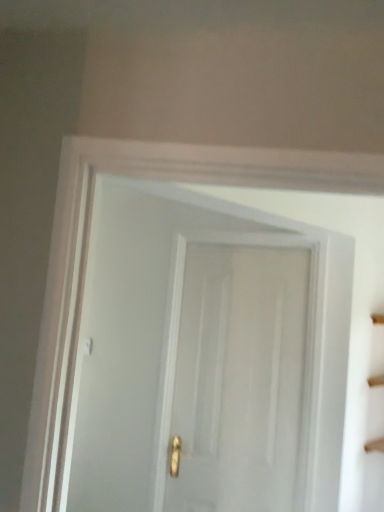
Question: Should I look upward or downward to see white matte stair at right?

Choices:
 (A) up
 (B) down

Answer: (B)